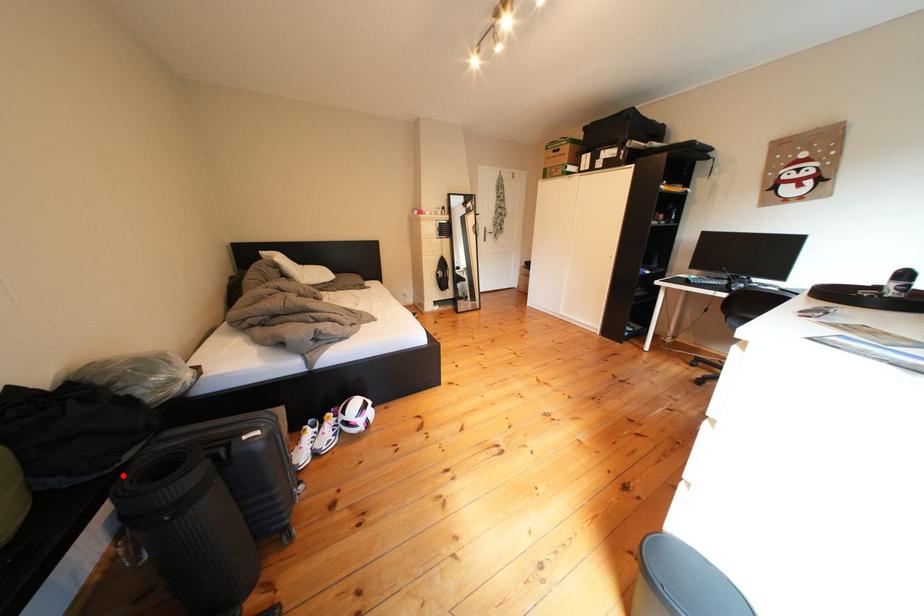
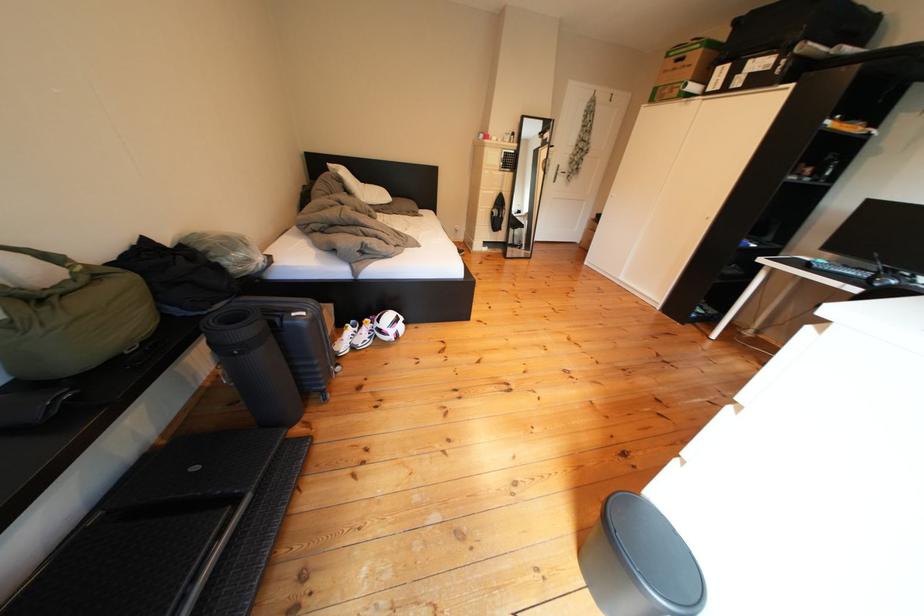
In the second image, find the point that corresponds to the highlighted location in the first image.

(217, 318)